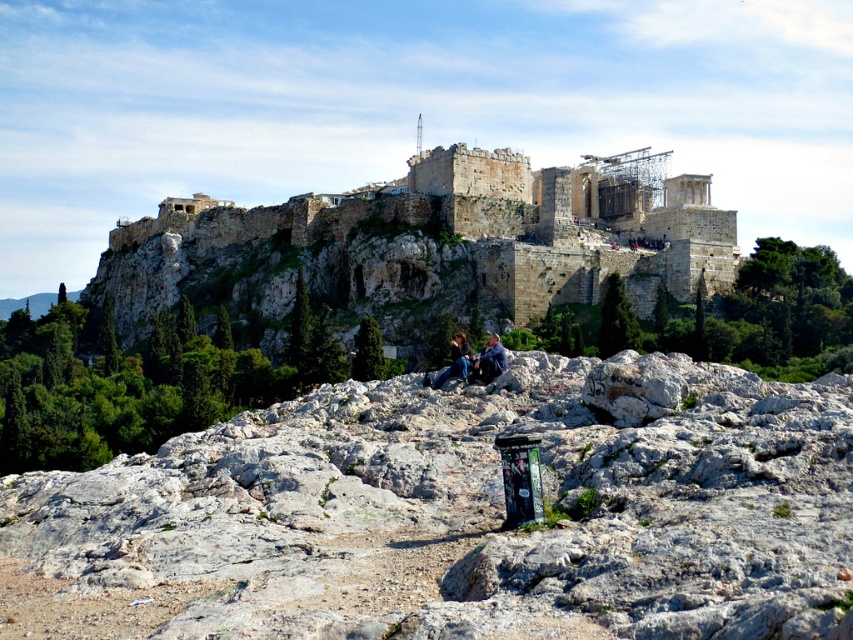
Is the position of blue denim jeans at center more distant than that of blue jeans at center?

Yes, it is behind blue jeans at center.

Who is higher up, blue denim jeans at center or blue jeans at center?

blue denim jeans at center is higher up.

Between point (486, 356) and point (491, 348), which one is positioned behind?

The point (491, 348) is behind.

This screenshot has width=853, height=640. Identify the location of blue denim jeans at center. (473, 360).

Who is more distant from viewer, (140, 536) or (178, 237)?

Positioned behind is point (178, 237).

What do you see at coordinates (480, 508) in the screenshot? The width and height of the screenshot is (853, 640). I see `white rock at center` at bounding box center [480, 508].

In order to click on white rock at center in this screenshot , I will do `click(480, 508)`.

Does stone/rough stone ancient structure at upper center have a greater width compared to blue denim jeans at center?

Yes.

Who is positioned more to the right, stone/rough stone ancient structure at upper center or blue denim jeans at center?

From the viewer's perspective, blue denim jeans at center appears more on the right side.

You are a GUI agent. You are given a task and a screenshot of the screen. Output one action in this format:
    pyautogui.click(x=<x>, y=<y>)
    Task: Click on the stone/rough stone ancient structure at upper center
    The height and width of the screenshot is (640, 853).
    Given the screenshot: What is the action you would take?
    pyautogui.click(x=434, y=244)